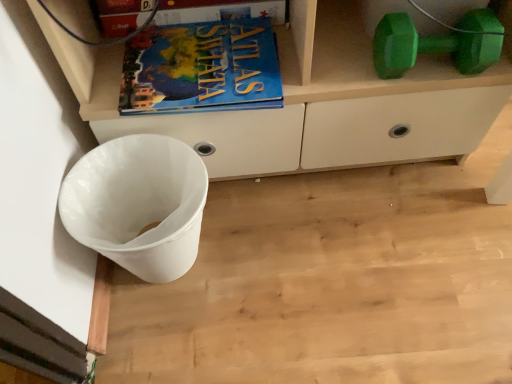
At what (x,y) coordinates should I click in order to perform the action: click on vacant area on top of blue matte atlas book at upper center (from a real-world perspective). Please return your answer as a coordinate pair (x, y). This screenshot has width=512, height=384. Looking at the image, I should click on (200, 57).